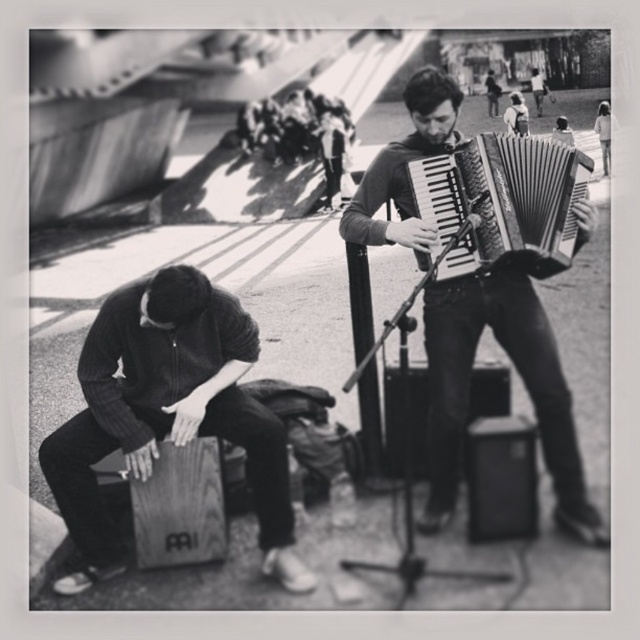
Question: Which point is closer to the camera taking this photo?

Choices:
 (A) (150, 458)
 (B) (474, 298)

Answer: (A)

Question: Can you confirm if wooden cajon at lower left is positioned to the right of metallic accordion at center?

Choices:
 (A) yes
 (B) no

Answer: (B)

Question: Among these objects, which one is nearest to the camera?

Choices:
 (A) wooden cajon at lower left
 (B) metallic accordion at center

Answer: (A)

Question: Which object appears closest to the camera in this image?

Choices:
 (A) metallic accordion at center
 (B) wooden cajon at lower left

Answer: (B)

Question: Can you confirm if metallic accordion at center is positioned to the right of metallic silver accordion at center?

Choices:
 (A) no
 (B) yes

Answer: (A)

Question: Is wooden cajon at lower left below metallic accordion at center?

Choices:
 (A) no
 (B) yes

Answer: (B)